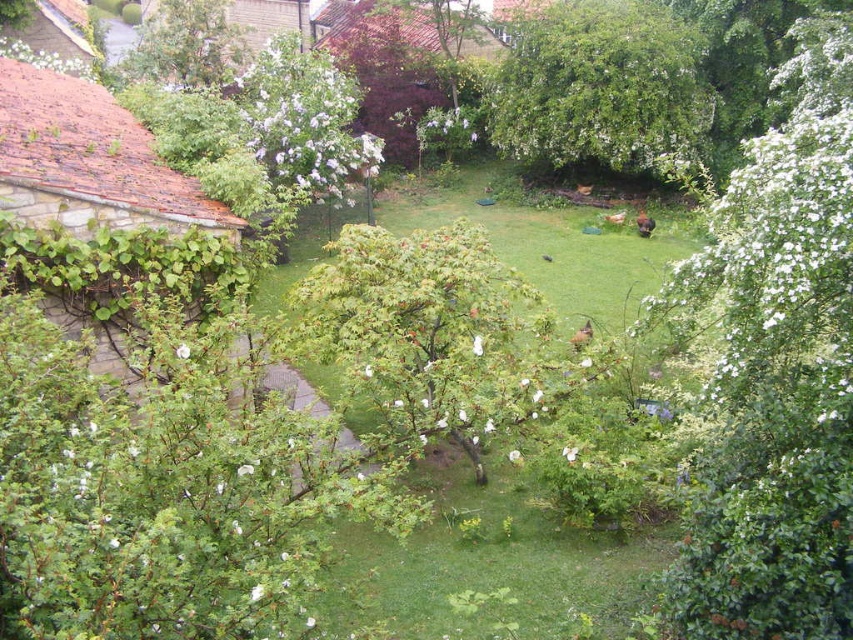
Question: Is the position of green grass at center more distant than that of green leafy bush at upper center?

Choices:
 (A) no
 (B) yes

Answer: (A)

Question: Is white fluffy bush at right above green leafy bush at upper center?

Choices:
 (A) yes
 (B) no

Answer: (B)

Question: Based on their relative distances, which object is nearer to the green leafy bush at upper center?

Choices:
 (A) green leafy tree at upper left
 (B) white fluffy bush at right
 (C) green grass at center

Answer: (C)

Question: Can you confirm if white fluffy bush at right is wider than green leafy tree at upper left?

Choices:
 (A) yes
 (B) no

Answer: (A)

Question: Considering the real-world distances, which object is farthest from the white fluffy bush at right?

Choices:
 (A) green leafy bush at upper center
 (B) green grass at center
 (C) green leafy tree at upper left

Answer: (C)

Question: Considering the real-world distances, which object is farthest from the green grass at center?

Choices:
 (A) white fluffy bush at right
 (B) green leafy tree at upper left
 (C) green leafy bush at upper center

Answer: (C)